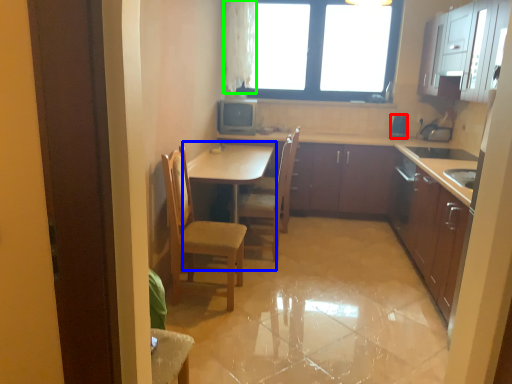
Question: Estimate the real-world distances between objects in this image. Which object is farther from appliance (highlighted by a red box), table (highlighted by a blue box) or curtain (highlighted by a green box)?

Choices:
 (A) table
 (B) curtain

Answer: (A)